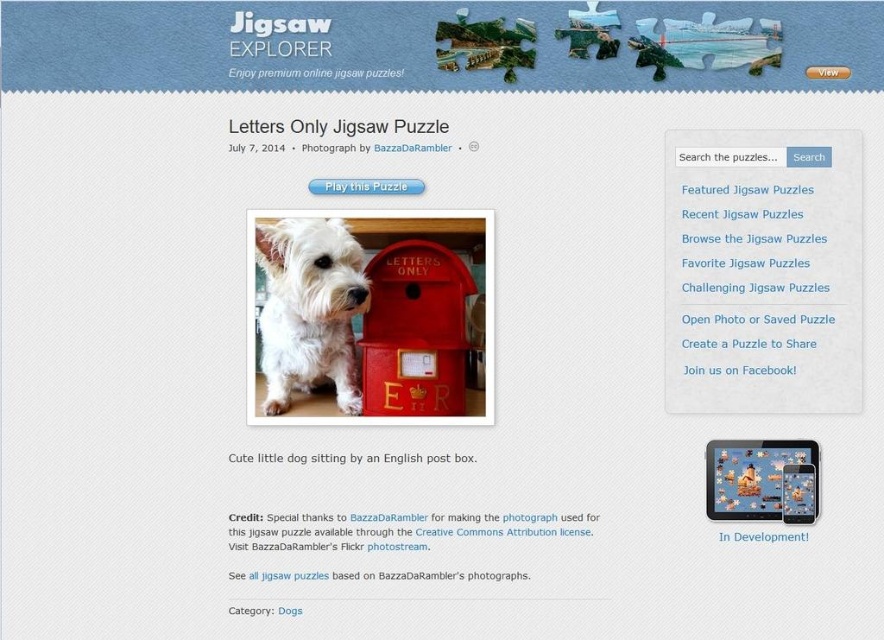
Question: Which point is farther from the camera taking this photo?

Choices:
 (A) (770, 531)
 (B) (332, 326)
 (C) (372, 371)
 (D) (783, 449)

Answer: (B)

Question: Can you confirm if metallic silver tablet at center is positioned below in development paper at center?

Choices:
 (A) yes
 (B) no

Answer: (B)

Question: Does white fluffy dog at center have a larger size compared to in development paper at center?

Choices:
 (A) yes
 (B) no

Answer: (A)

Question: Which point appears farthest from the camera in this image?

Choices:
 (A) (404, 317)
 (B) (795, 532)
 (C) (301, 380)
 (D) (706, 458)

Answer: (C)

Question: Which point is farther to the camera?

Choices:
 (A) red matte mailbox at center
 (B) metallic silver tablet at center
 (C) in development paper at center
 (D) white fluffy dog at center

Answer: (A)

Question: Does red matte mailbox at center appear on the left side of metallic silver tablet at center?

Choices:
 (A) no
 (B) yes

Answer: (B)